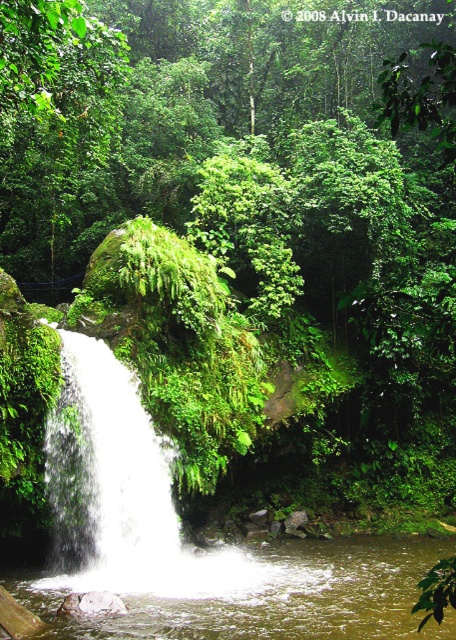
Question: Which of the following is the farthest from the observer?

Choices:
 (A) white frothy water at left
 (B) clear water at center

Answer: (A)

Question: Which object is closer to the camera taking this photo?

Choices:
 (A) clear water at center
 (B) white frothy water at left

Answer: (A)

Question: Observing the image, what is the correct spatial positioning of clear water at center in reference to white frothy water at left?

Choices:
 (A) above
 (B) below

Answer: (B)

Question: Which point is closer to the camera taking this photo?

Choices:
 (A) (102, 460)
 (B) (336, 561)

Answer: (A)

Question: Is clear water at center positioned before white frothy water at left?

Choices:
 (A) no
 (B) yes

Answer: (B)

Question: Is clear water at center positioned behind white frothy water at left?

Choices:
 (A) no
 (B) yes

Answer: (A)